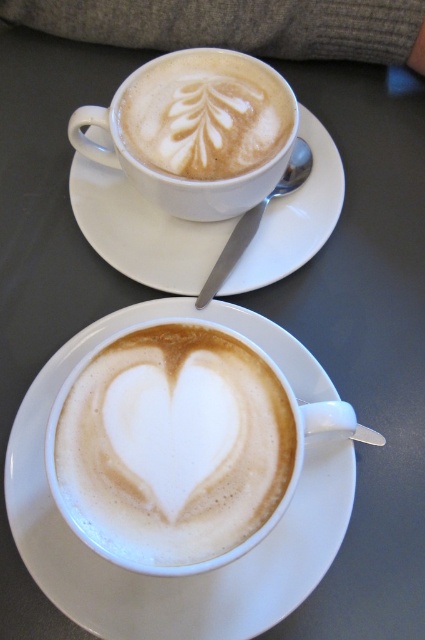
You are a barista trying to place a new latte art design on the white ceramic saucer at upper center. The latte art at upper center is already there. Can you fit a larger latte art design on the saucer without it overlapping the existing one?

The white ceramic saucer at upper center is bigger than the latte art at upper center, so yes, you can fit a larger latte art design on the saucer without overlapping the existing one as there is space available.

You are a barista preparing coffee and need to place a new cup on the table. The table has two existing saucers, the white ceramic saucer at center and the white ceramic saucer at upper center. Which saucer is closer to the edge of the table?

The white ceramic saucer at upper center is closer to the edge of the table because it is shorter than the white ceramic saucer at center.

You are a barista trying to clean the white ceramic saucer at center and the latte art at upper center. Which object should you clean first if you want to avoid spilling the latte art?

You should clean the white ceramic saucer at center first because it is located below the latte art at upper center. If you clean the latte art at upper center first, you might accidentally spill it onto the saucer below.